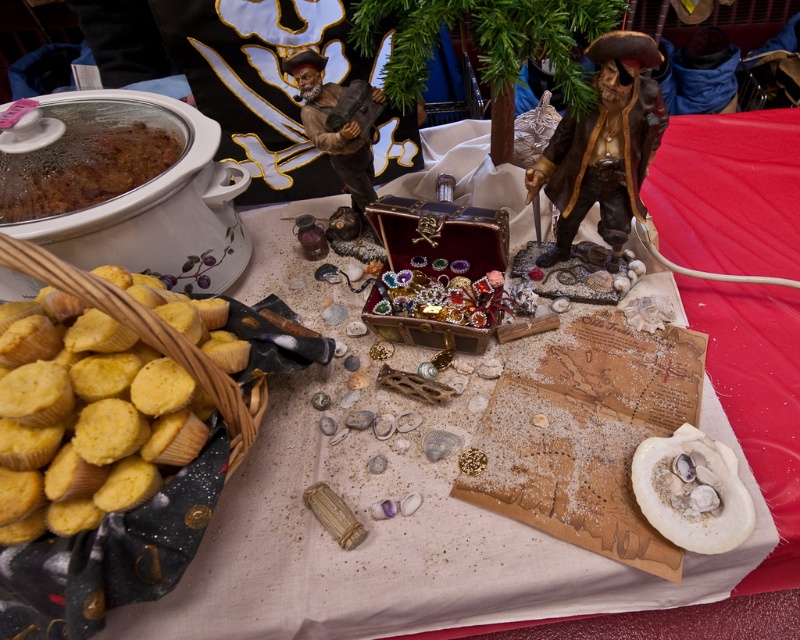
Between point (700, 540) and point (362, 157), which one is positioned behind?

Positioned behind is point (362, 157).

You are a GUI agent. You are given a task and a screenshot of the screen. Output one action in this format:
    pyautogui.click(x=<x>, y=<y>)
    Task: Click on the white shell at center
    
    Given the screenshot: What is the action you would take?
    pyautogui.click(x=692, y=490)

Does matte brown pirate at center appear under white shell at center?

No, matte brown pirate at center is not below white shell at center.

Does matte brown pirate at center have a lesser height compared to white shell at center?

No.

Between point (632, 68) and point (752, 516), which one is positioned in front?

Positioned in front is point (752, 516).

I want to click on matte brown pirate at center, so click(604, 147).

Can you confirm if yellow paper muffins at lower left is smaller than brown matte chili at upper left?

No.

Does point (20, 305) lie behind point (112, 108)?

No, it is in front of (112, 108).

The image size is (800, 640). Identify the location of yellow paper muffins at lower left. (85, 419).

Image resolution: width=800 pixels, height=640 pixels. I want to click on yellow paper muffins at lower left, so click(x=85, y=419).